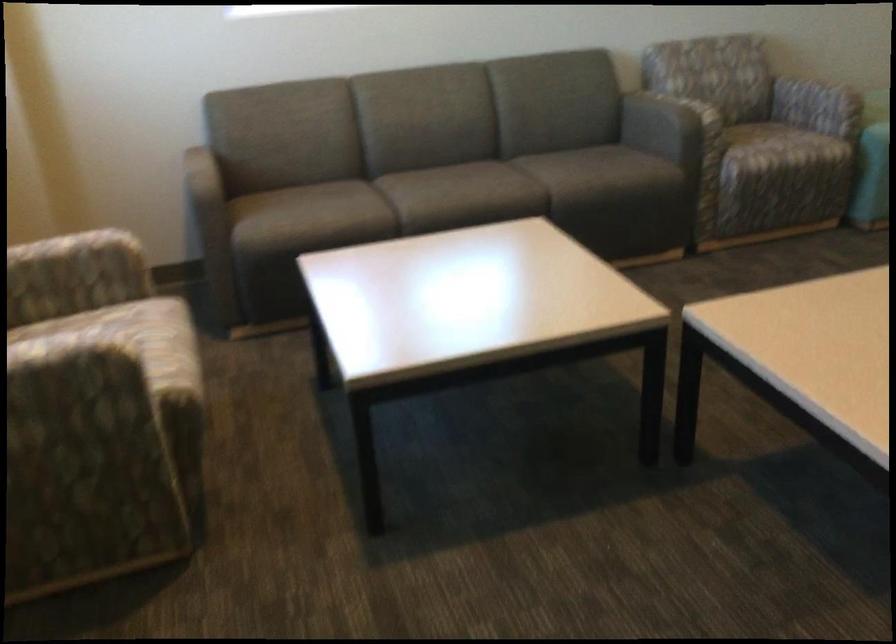
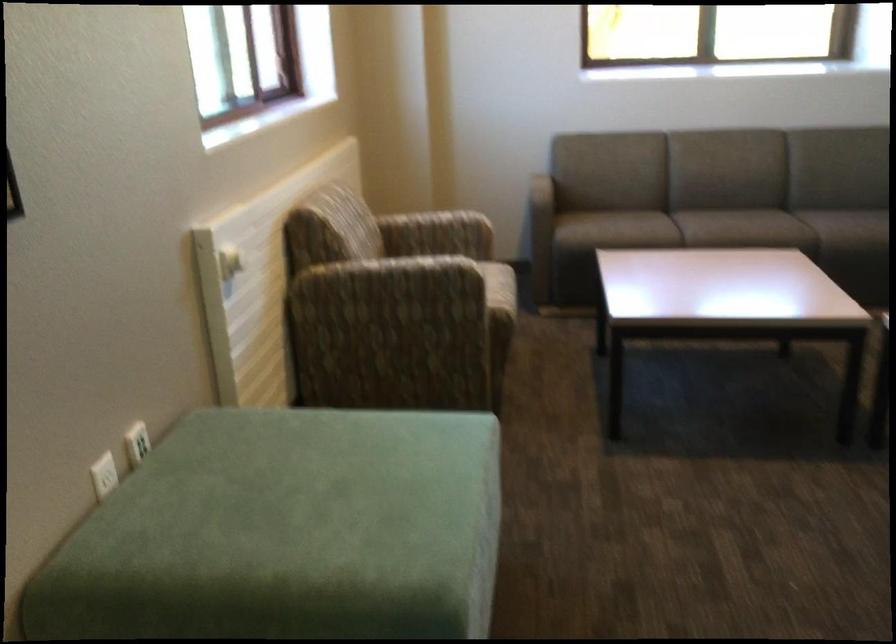
Locate, in the second image, the point that corresponds to [104,301] in the first image.

(458, 254)